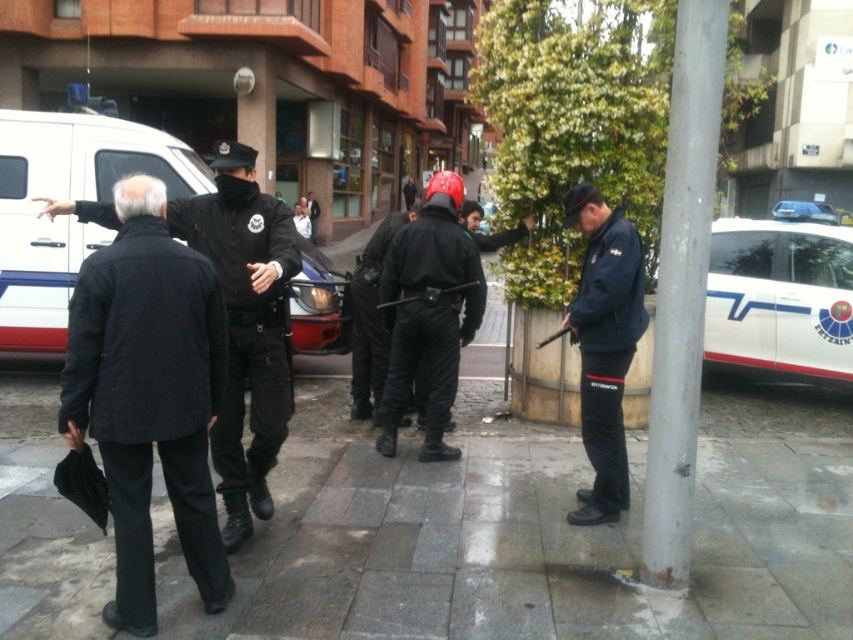
You are a pedestrian standing on the sidewalk and see the white glossy police car at right and the black uniformed man at center. Which object is closer to you?

The white glossy police car at right is closer to you because it is in front of the black uniformed man at center, indicating it is nearer in the scene.

You are a photographer standing at the camera position. You want to take a photo of both the point at coordinates point (x=79, y=228) and point (x=312, y=205). Which point will appear larger in your photo?

Point (x=79, y=228) is closer to the camera than point (x=312, y=205), so it will appear larger in the photo.